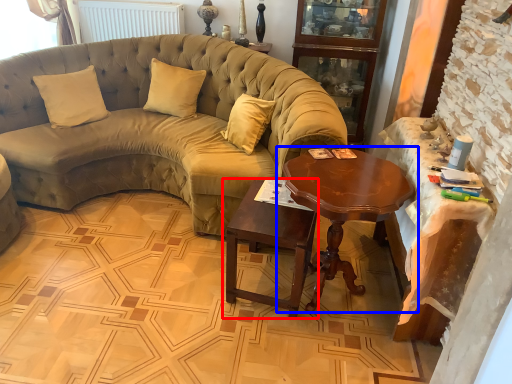
Question: Which object is further to the camera taking this photo, table (highlighted by a red box) or coffee table (highlighted by a blue box)?

Choices:
 (A) table
 (B) coffee table

Answer: (A)